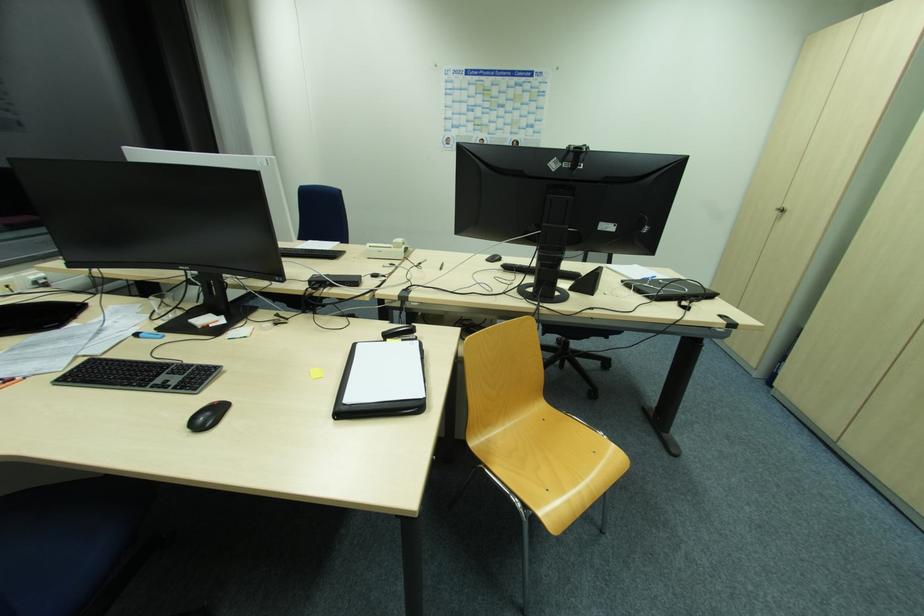
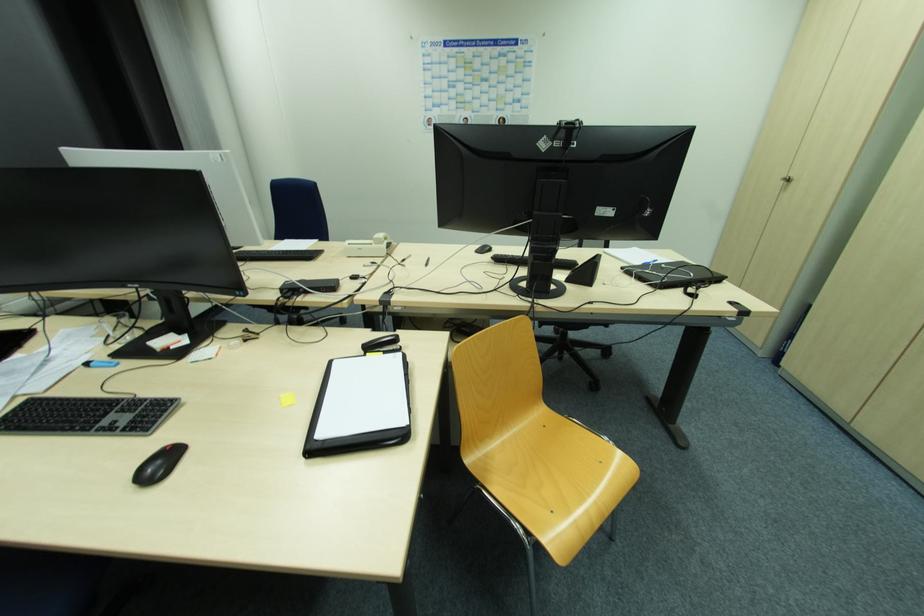
Question: How did the camera likely rotate?

Choices:
 (A) Left
 (B) Right
 (C) Up
 (D) Down

Answer: (D)